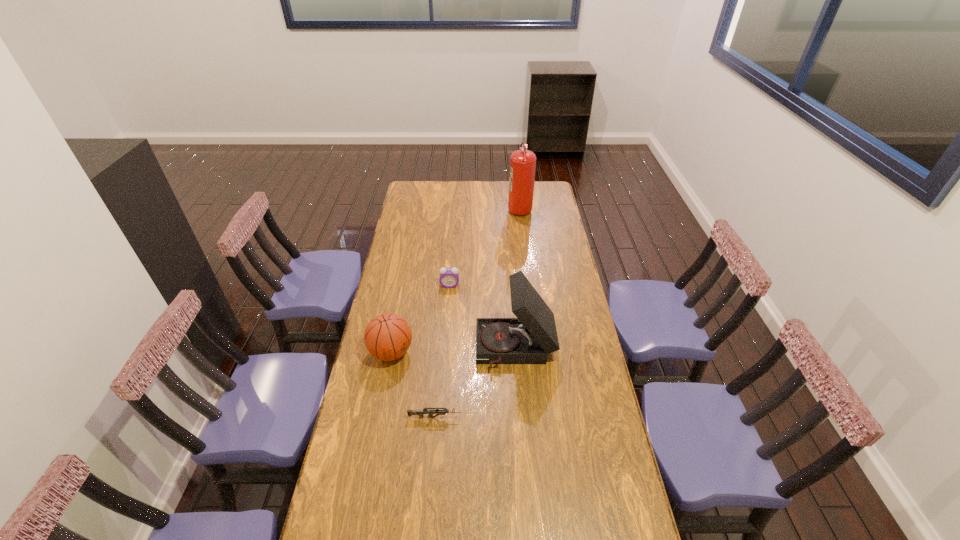
Locate an element on the screen. This screenshot has height=540, width=960. the tallest object is located at coordinates (523, 162).

You are a GUI agent. You are given a task and a screenshot of the screen. Output one action in this format:
    pyautogui.click(x=<x>, y=<y>)
    Task: Click on the farthest object
    The height and width of the screenshot is (540, 960).
    Given the screenshot: What is the action you would take?
    pyautogui.click(x=523, y=162)

Locate an element on the screen. The image size is (960, 540). the fourth shortest object is located at coordinates (528, 339).

Where is `the third tallest object`? the third tallest object is located at coordinates (387, 337).

Identify the location of basketball. (387, 337).

The height and width of the screenshot is (540, 960). What are the coordinates of `alarm clock` in the screenshot? It's located at (449, 277).

Identify the location of the second farthest object. The image size is (960, 540). (449, 277).

Identify the location of the shortest object. (420, 413).

Identify the location of gun. Image resolution: width=960 pixels, height=540 pixels. (420, 413).

Where is `free space located on the instruction side of the tallest object`? Image resolution: width=960 pixels, height=540 pixels. free space located on the instruction side of the tallest object is located at coordinates (478, 208).